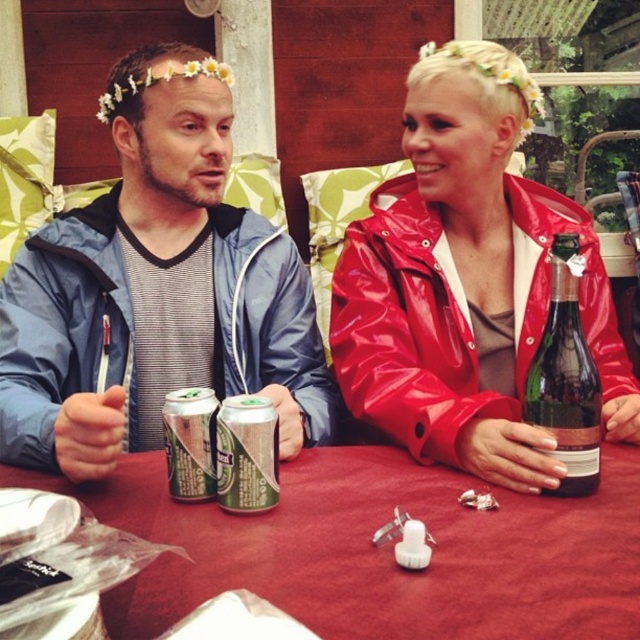
You are standing in front of the table where the two people are sitting. There are two points marked on the table surface. One is at coordinates point (36, 460) and the other is at point (170, 394). Which point is closer to you?

Point (36, 460) is closer to you because it is further to the viewer than point (170, 394).

You are planning to pack a bag for a picnic and have a space that can fit items up to the size of the green glass bottle at center. Can the matte blue jacket at left fit in this space?

The matte blue jacket at left is bigger than the green glass bottle at center, so it cannot fit in the space designated for items up to the size of the green glass bottle at center.